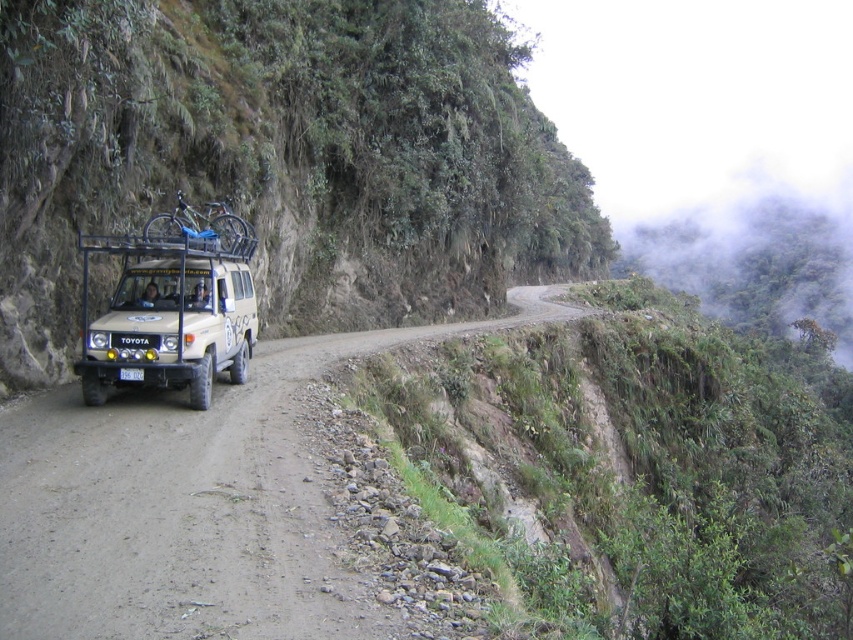
You are standing at the point marked as point (189,504). Which direction should you walk to reach the dirt road at center?

The dirt road at center is located at point (189,504), so you are already at the dirt road at center.

You are a hiker planning to walk from point A to point B along the rugged, unpaved road in the mountainous terrain. Point A is at point (337, 88) and point B is at point (271, 508). Which point is closer to you when you start your hike?

Point A at (337, 88) is closer to you since it is further to the viewer than point B at (271, 508), meaning it is physically nearer in the scene.